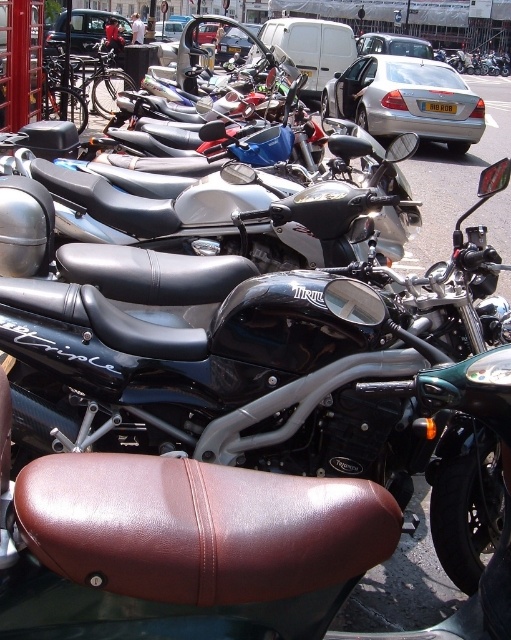
Does black leather seat at center have a lesser width compared to silver metallic sedan at center?

Yes, black leather seat at center is thinner than silver metallic sedan at center.

Does black leather seat at center have a larger size compared to silver metallic sedan at center?

No, black leather seat at center is not bigger than silver metallic sedan at center.

Is point (387, 152) positioned after point (327, 96)?

No, (387, 152) is in front of (327, 96).

Where is `black leather seat at center`? black leather seat at center is located at coordinates (212, 211).

Which is more to the right, metallic silver car at center or silver metallic sedan at upper center?

silver metallic sedan at upper center

Between metallic silver car at center and silver metallic sedan at upper center, which one has less height?

metallic silver car at center

Is point (82, 38) positioned before point (398, 35)?

That is True.

In order to click on metallic silver car at center in this screenshot , I will do `click(94, 28)`.

Does silver metallic sedan at center appear over silver metallic sedan at upper center?

No.

Can you confirm if silver metallic sedan at center is positioned below silver metallic sedan at upper center?

Correct, silver metallic sedan at center is located below silver metallic sedan at upper center.

Between point (474, 118) and point (359, 44), which one is positioned in front?

Point (474, 118)

Where is `silver metallic sedan at center`? silver metallic sedan at center is located at coordinates (406, 100).